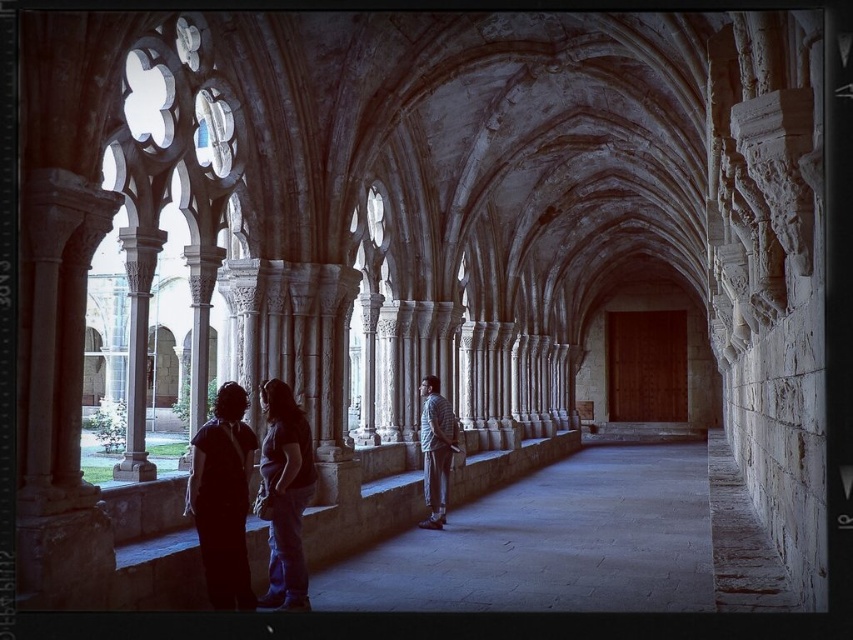
Is dark fabric dress at lower left shorter than dark gray fabric shirt at center?

Yes, dark fabric dress at lower left is shorter than dark gray fabric shirt at center.

Can you confirm if dark fabric dress at lower left is positioned above dark gray fabric shirt at center?

Yes, dark fabric dress at lower left is above dark gray fabric shirt at center.

This screenshot has height=640, width=853. Describe the element at coordinates (222, 499) in the screenshot. I see `dark fabric dress at lower left` at that location.

Where is `dark fabric dress at lower left`? Image resolution: width=853 pixels, height=640 pixels. dark fabric dress at lower left is located at coordinates (222, 499).

Does dark fabric dress at lower left have a lesser height compared to plaid shirt at center?

Indeed, dark fabric dress at lower left has a lesser height compared to plaid shirt at center.

Does dark fabric dress at lower left have a lesser width compared to plaid shirt at center?

No.

You are a GUI agent. You are given a task and a screenshot of the screen. Output one action in this format:
    pyautogui.click(x=<x>, y=<y>)
    Task: Click on the dark fabric dress at lower left
    This screenshot has width=853, height=640.
    Given the screenshot: What is the action you would take?
    pyautogui.click(x=222, y=499)

This screenshot has height=640, width=853. In order to click on dark fabric dress at lower left in this screenshot , I will do `click(222, 499)`.

Can you confirm if dark gray fabric shirt at center is thinner than plaid shirt at center?

No, dark gray fabric shirt at center is not thinner than plaid shirt at center.

Does dark gray fabric shirt at center have a greater height compared to plaid shirt at center?

Indeed, dark gray fabric shirt at center has a greater height compared to plaid shirt at center.

Is point (299, 461) farther from camera compared to point (450, 413)?

No, it is not.

Locate an element on the screen. The image size is (853, 640). dark gray fabric shirt at center is located at coordinates (285, 493).